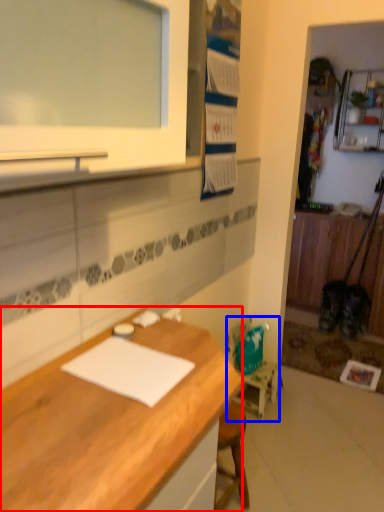
Question: Among these objects, which one is farthest to the camera, desk (highlighted by a red box) or chair (highlighted by a blue box)?

Choices:
 (A) desk
 (B) chair

Answer: (B)